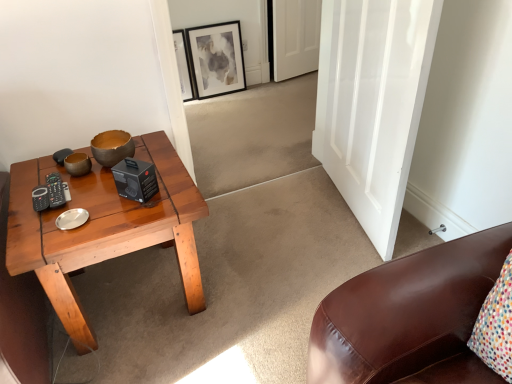
Where is `free space on the front side of matte brown bowl at center`? free space on the front side of matte brown bowl at center is located at coordinates coord(93,193).